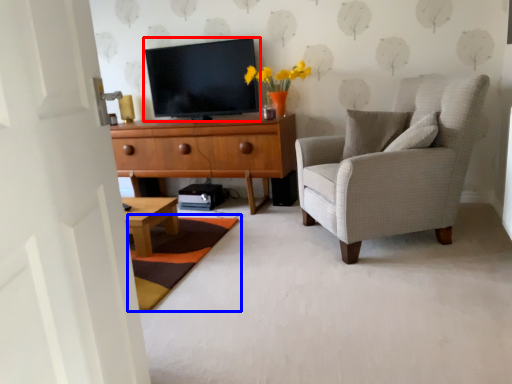
Question: Among these objects, which one is nearest to the camera, television (highlighted by a red box) or mat (highlighted by a blue box)?

Choices:
 (A) television
 (B) mat

Answer: (B)